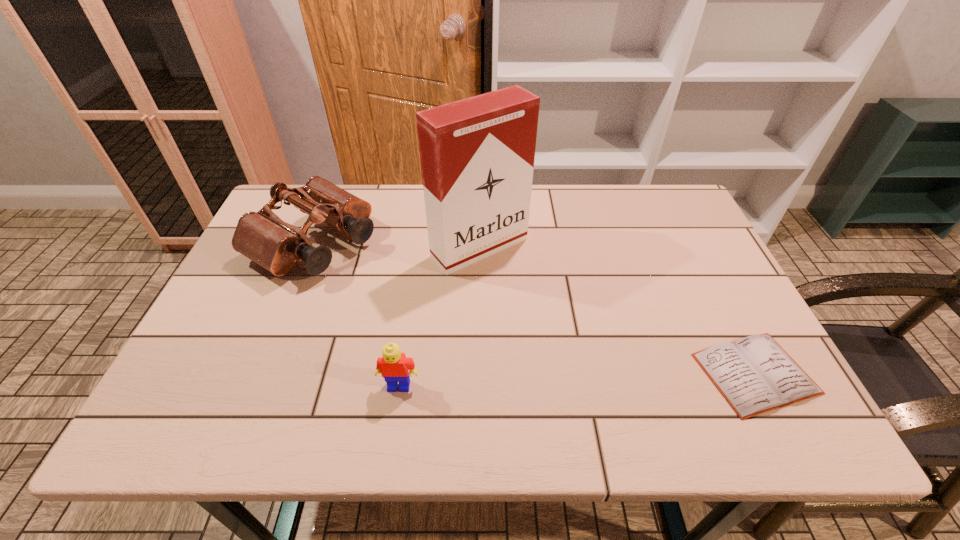
Where is `vacant position located 0.200m through the eyepieces of the leftmost object`? vacant position located 0.200m through the eyepieces of the leftmost object is located at coordinates (413, 302).

Where is `vacant space located 0.400m through the eyepieces of the leftmost object`? The width and height of the screenshot is (960, 540). vacant space located 0.400m through the eyepieces of the leftmost object is located at coordinates (477, 341).

Identify the location of free space located through the eyepieces of the leftmost object. This screenshot has height=540, width=960. (428, 312).

Locate an element on the screen. Image resolution: width=960 pixels, height=540 pixels. cigarette_case located in the far edge section of the desktop is located at coordinates (477, 154).

This screenshot has height=540, width=960. I want to click on binoculars at the far edge, so click(264, 238).

You are a GUI agent. You are given a task and a screenshot of the screen. Output one action in this format:
    pyautogui.click(x=<x>, y=<y>)
    Task: Click on the Lego positioned at the near edge
    The height and width of the screenshot is (540, 960).
    Given the screenshot: What is the action you would take?
    pyautogui.click(x=393, y=365)

The height and width of the screenshot is (540, 960). What are the coordinates of `diary present at the near edge` in the screenshot? It's located at (755, 374).

Image resolution: width=960 pixels, height=540 pixels. In order to click on object that is positioned at the left edge in this screenshot , I will do `click(264, 238)`.

The height and width of the screenshot is (540, 960). What are the coordinates of `object positioned at the right edge` in the screenshot? It's located at (755, 374).

In order to click on object at the far left corner in this screenshot , I will do `click(264, 238)`.